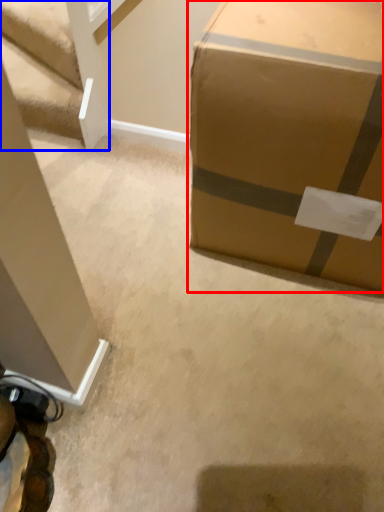
Question: Which of the following is the closest to the observer, box (highlighted by a red box) or stairwell (highlighted by a blue box)?

Choices:
 (A) box
 (B) stairwell

Answer: (A)